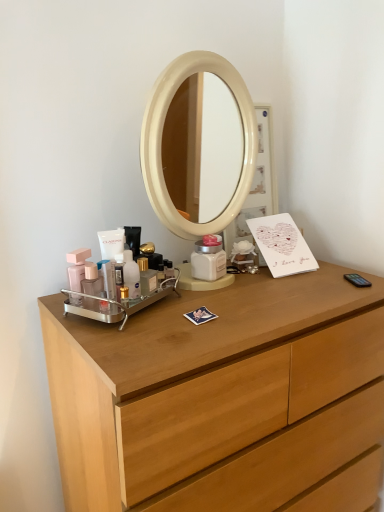
Find the location of a particular element. This screenshot has width=384, height=512. free spot in front of translucent plastic tube at center, the second toiletry viewed from the right is located at coordinates (124, 342).